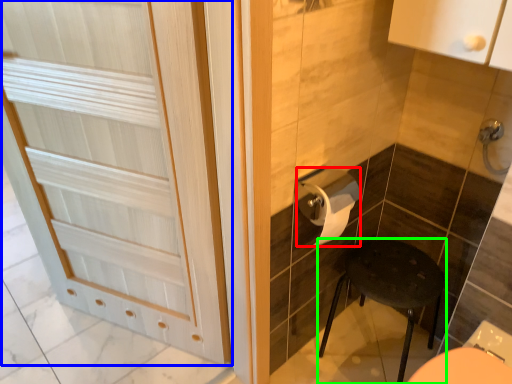
Question: Estimate the real-world distances between objects in this image. Which object is closer to toilet paper (highlighted by a red box), door (highlighted by a blue box) or furniture (highlighted by a green box)?

Choices:
 (A) door
 (B) furniture

Answer: (B)